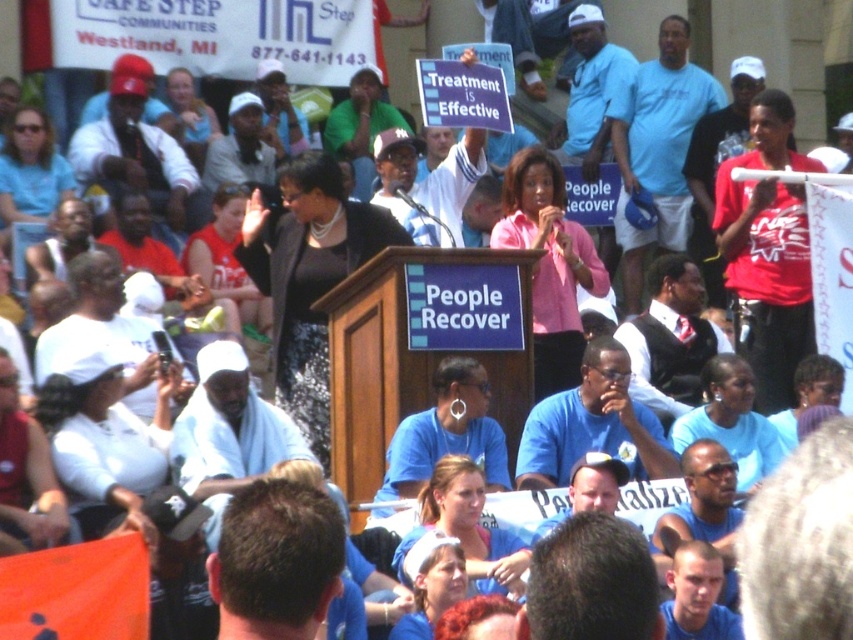
You are at the event and want to take a photo of the podium. If you move forward by 10 meters, how far will you be from the point at coordinates (x=358, y=221)?

The point at coordinates (x=358, y=221) is currently 81.37 meters away. If you move forward by 10 meters, your new distance to the point would be 81.37 meters minus 10 meters, which equals 71.37 meters.

You are a photographer at the event and want to capture both the pink fabric shirt at center and the light blue shirt at center in a single photo. Which shirt should you focus on to ensure both are in frame, considering their sizes?

The pink fabric shirt at center is much taller than the light blue shirt at center, so focusing on the pink fabric shirt at center would ensure both are in frame as it occupies more space.